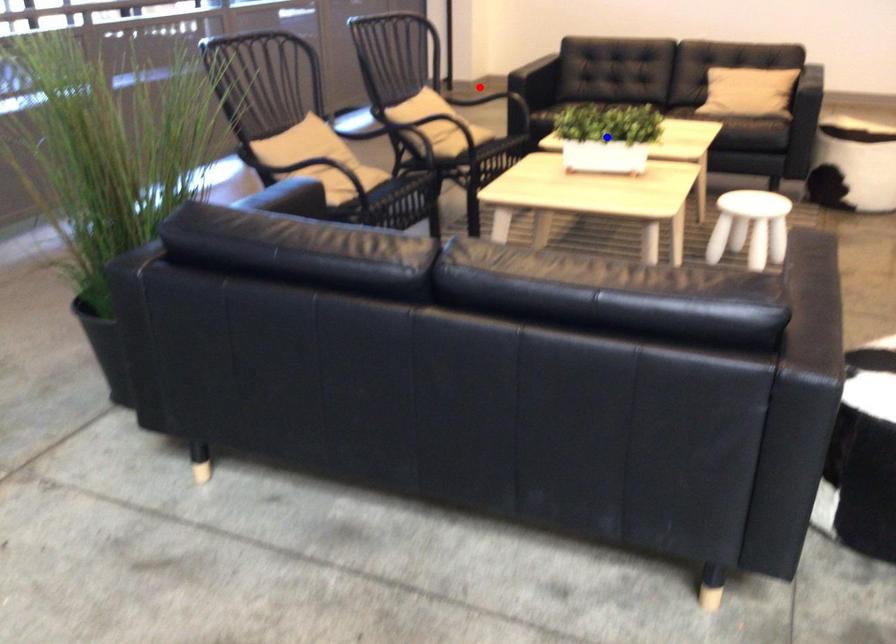
Question: In the image, two points are highlighted. Which point is nearer to the camera? Reply with the corresponding letter.

Choices:
 (A) blue point
 (B) red point

Answer: (A)